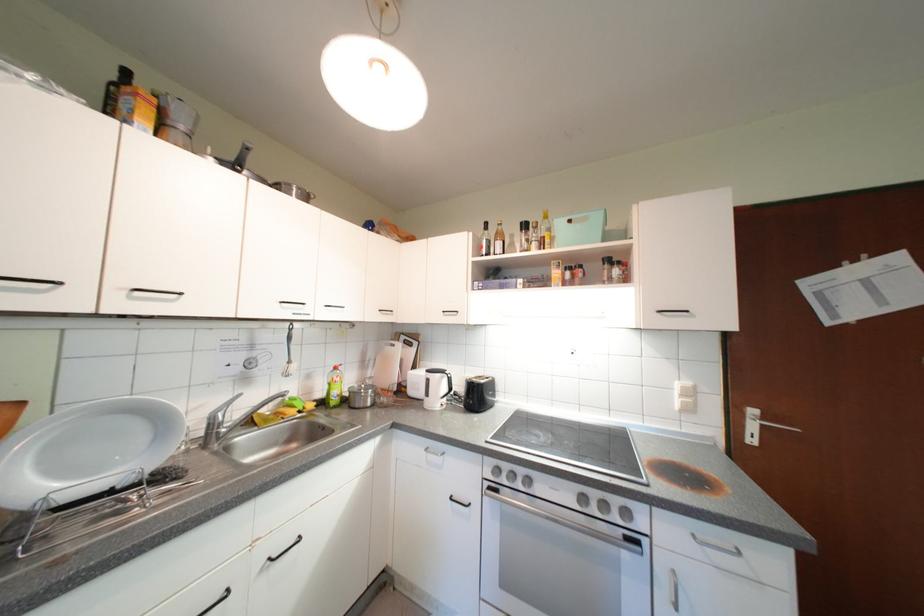
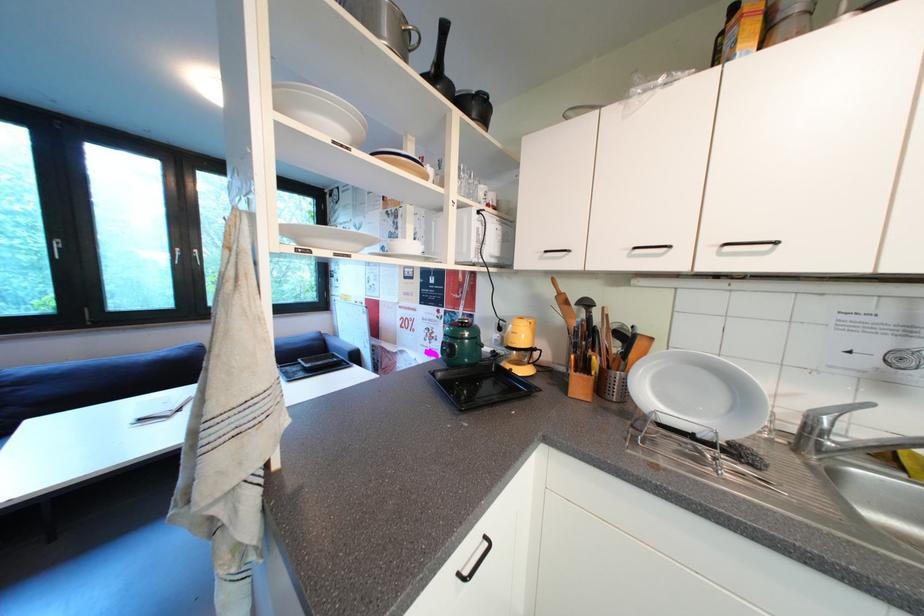
Question: The camera is either moving clockwise (left) or counter-clockwise (right) around the object. The first image is from the beginning of the video and the second image is from the end. Is the camera moving left or right when shooting the video?

Choices:
 (A) Left
 (B) Right

Answer: (B)